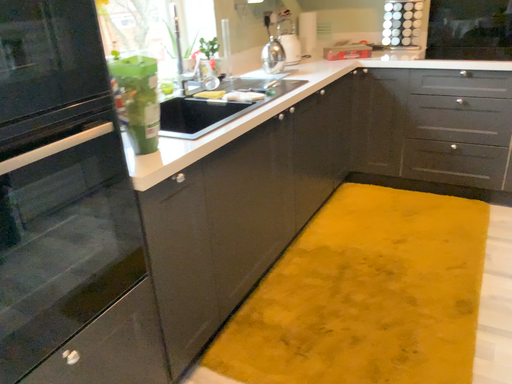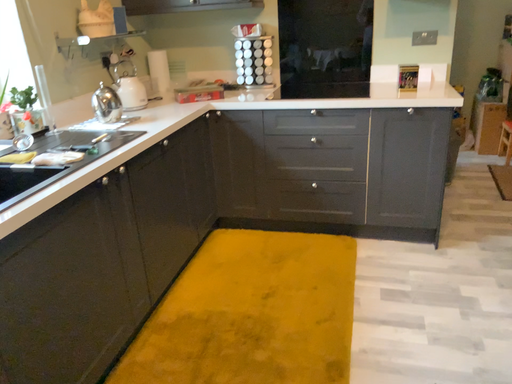
Question: How did the camera likely rotate when shooting the video?

Choices:
 (A) rotated left
 (B) rotated right

Answer: (B)